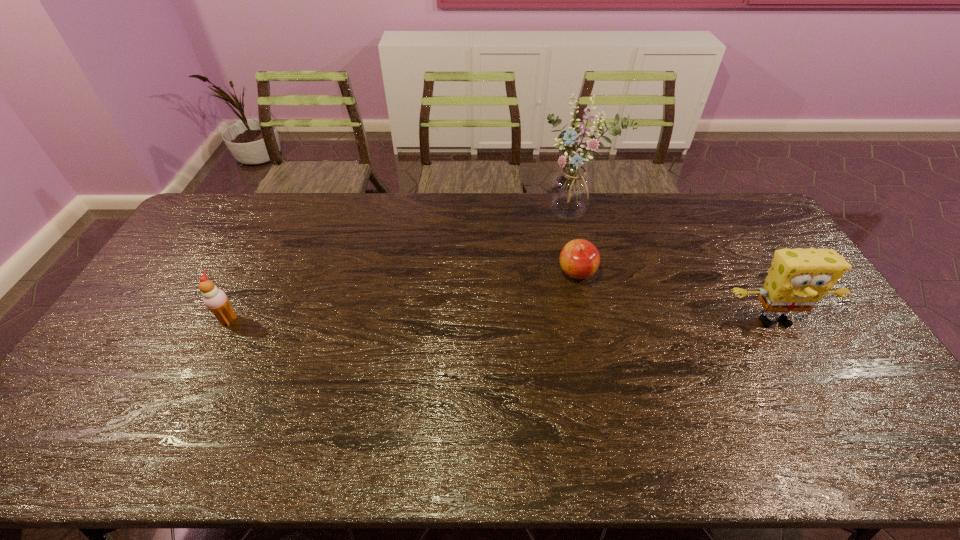
You are a GUI agent. You are given a task and a screenshot of the screen. Output one action in this format:
    pyautogui.click(x=<x>, y=<y>)
    Task: Click on the leftmost object
    
    Given the screenshot: What is the action you would take?
    pyautogui.click(x=215, y=299)

Where is `the third tallest object`? the third tallest object is located at coordinates (215, 299).

You are a GUI agent. You are given a task and a screenshot of the screen. Output one action in this format:
    pyautogui.click(x=<x>, y=<y>)
    Task: Click on the third shortest object
    This screenshot has width=960, height=540.
    Given the screenshot: What is the action you would take?
    pyautogui.click(x=798, y=278)

Image resolution: width=960 pixels, height=540 pixels. In order to click on the rightmost object in this screenshot , I will do `click(798, 278)`.

Identify the location of the tallest object. (570, 190).

Find the location of a particular element. This screenshot has height=540, width=960. bouquet is located at coordinates (570, 190).

Identify the location of the second farthest object. This screenshot has height=540, width=960. (579, 259).

Find the location of a particular element. The height and width of the screenshot is (540, 960). apple is located at coordinates (579, 259).

Identify the location of vacant area situated 0.110m at the front with a straw on the third tallest object. The height and width of the screenshot is (540, 960). (276, 320).

At what (x,y) coordinates should I click in order to perform the action: click on vacant area situated on the face of the sponge. Please return your answer as a coordinate pair (x, y). The image size is (960, 540). Looking at the image, I should click on point(808,381).